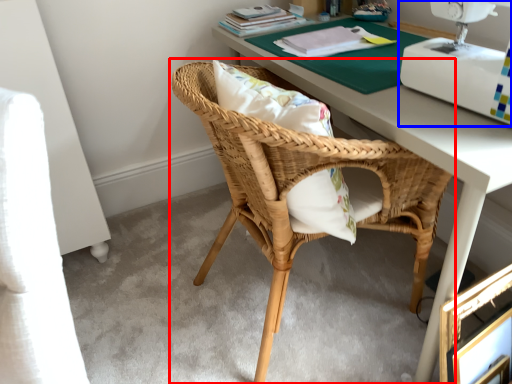
Question: Which point is further to the camera, chair (highlighted by a red box) or sewing machine (highlighted by a blue box)?

Choices:
 (A) chair
 (B) sewing machine

Answer: (A)